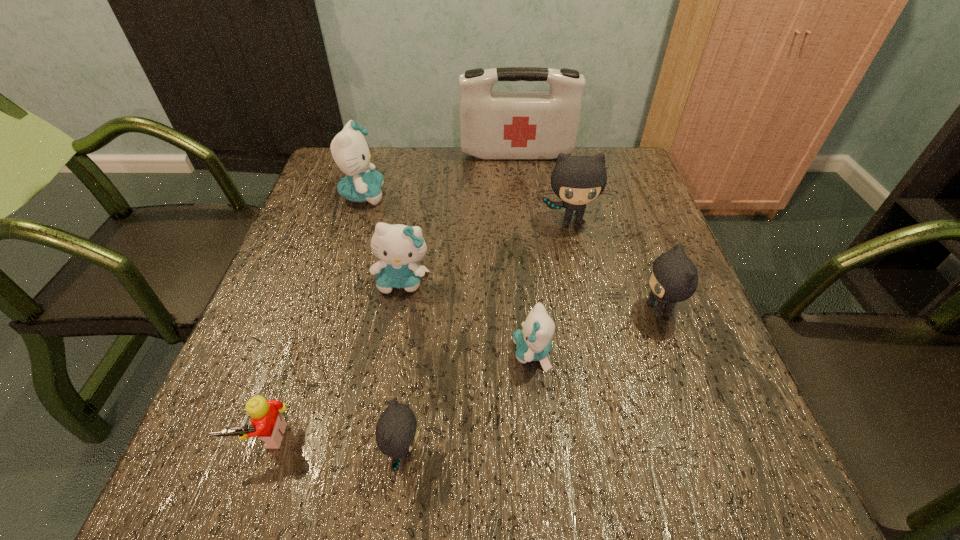
Identify the location of blank area in the image that satisfies the following two spatial constraints: 1. on the front side of the farthest object; 2. on the face of the rightmost blue kitten. The height and width of the screenshot is (540, 960). (539, 353).

At what (x,y) coordinates should I click in order to perform the action: click on free spot that satisfies the following two spatial constraints: 1. on the front-facing side of the rightmost object; 2. in front of the Lego with the accessory visible. Please return your answer as a coordinate pair (x, y). Image resolution: width=960 pixels, height=540 pixels. Looking at the image, I should click on (706, 437).

Find the location of `free point that satisfies the following two spatial constraints: 1. on the front side of the tallest object; 2. on the front-facing side of the smallest gray kitten`. free point that satisfies the following two spatial constraints: 1. on the front side of the tallest object; 2. on the front-facing side of the smallest gray kitten is located at coordinates click(x=550, y=451).